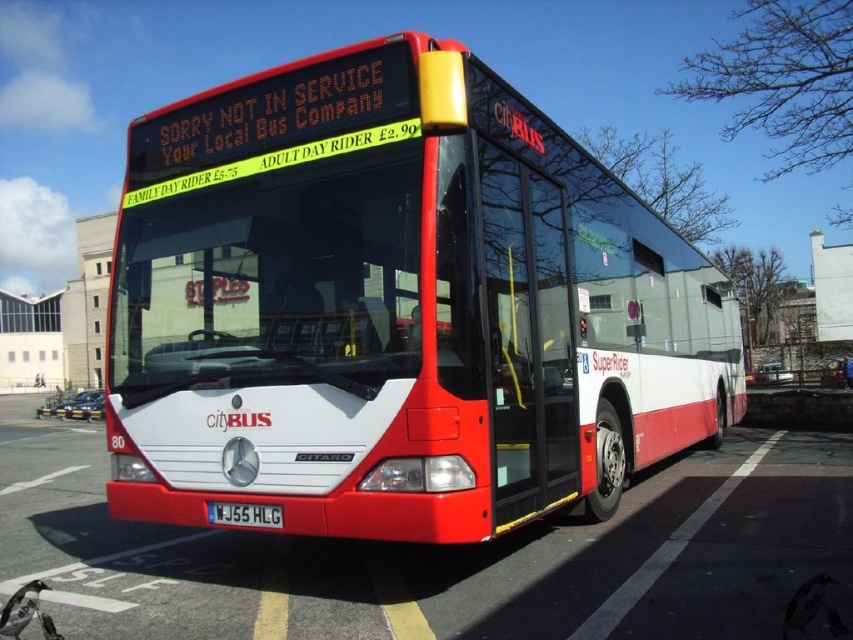
What are the coordinates of the matte white bus at center?

The matte white bus at center is located at point (396, 307).

Looking at this image, you are a delivery person who needs to attach a package to the white glossy bus at center. The package requires a minimum of 1 square meter of flat space. Can the black plastic license plate at center interfere with this requirement?

The white glossy bus at center is larger than the black plastic license plate at center, so there should be sufficient space to attach the package without interference from the license plate.

You are standing in front of the Citybus vehicle and want to touch both points marked on the bus. Which point should you reach for first, the point at coordinate (155, 173) or the point at (248, 522)?

You should reach for the point at coordinate (155, 173) first because it is closer to you than the point at (248, 522).